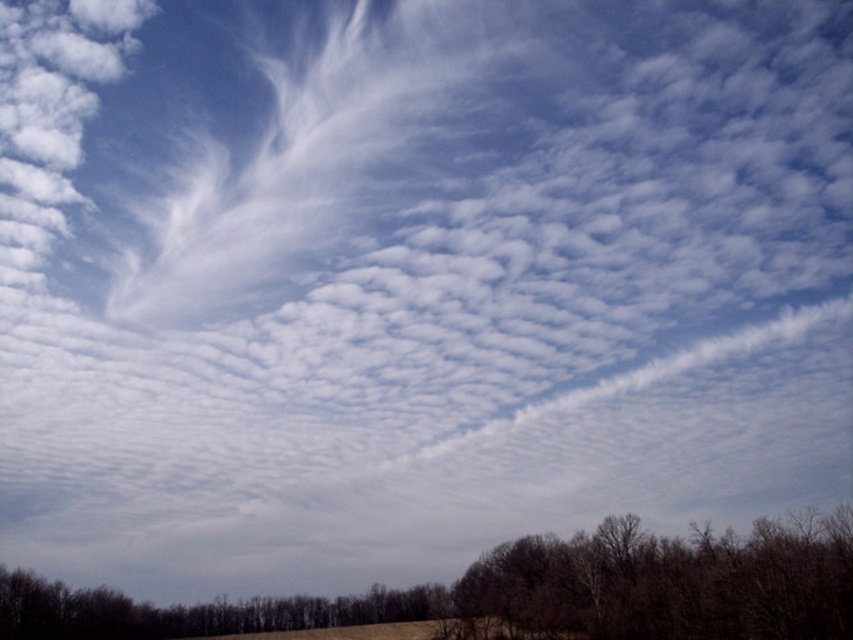
Question: Is brown leafless trees at lower center above brown matte tree at lower right?

Choices:
 (A) yes
 (B) no

Answer: (B)

Question: Can you confirm if brown leafless trees at lower center is wider than brown matte tree at lower right?

Choices:
 (A) yes
 (B) no

Answer: (A)

Question: Is brown leafless trees at lower center positioned before brown matte tree at lower right?

Choices:
 (A) no
 (B) yes

Answer: (A)

Question: Which of the following is the closest to the observer?

Choices:
 (A) brown leafless trees at lower center
 (B) brown matte tree at lower right

Answer: (B)

Question: Which of the following is the farthest from the observer?

Choices:
 (A) brown matte tree at lower right
 (B) brown leafless trees at lower center

Answer: (B)